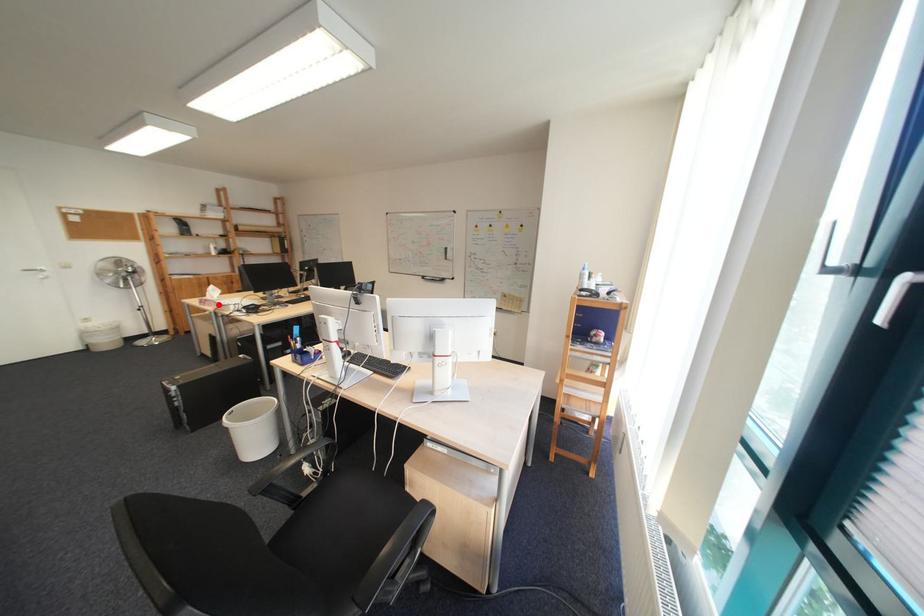
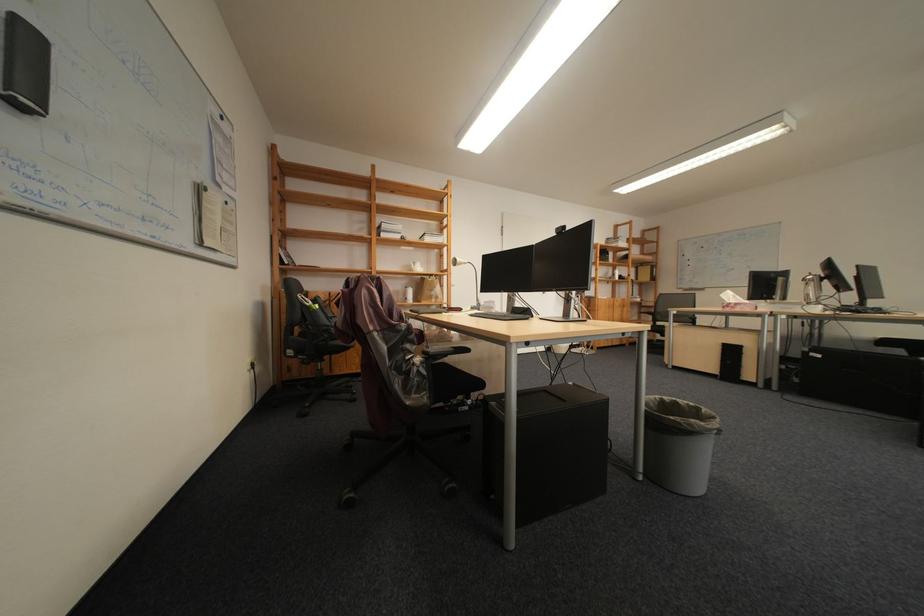
Locate, in the second image, the point that corresponds to the highlighted location in the first image.

(747, 309)